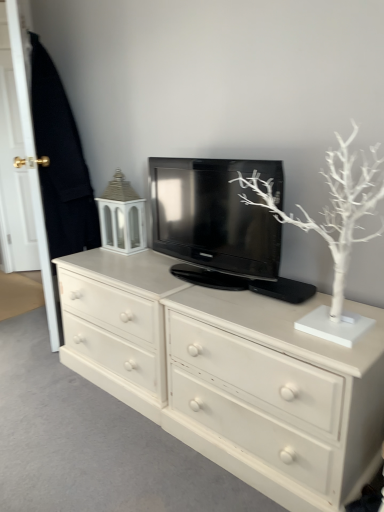
Identify the location of vacant area that is in front of white wood door at left. This screenshot has height=512, width=384. (30, 360).